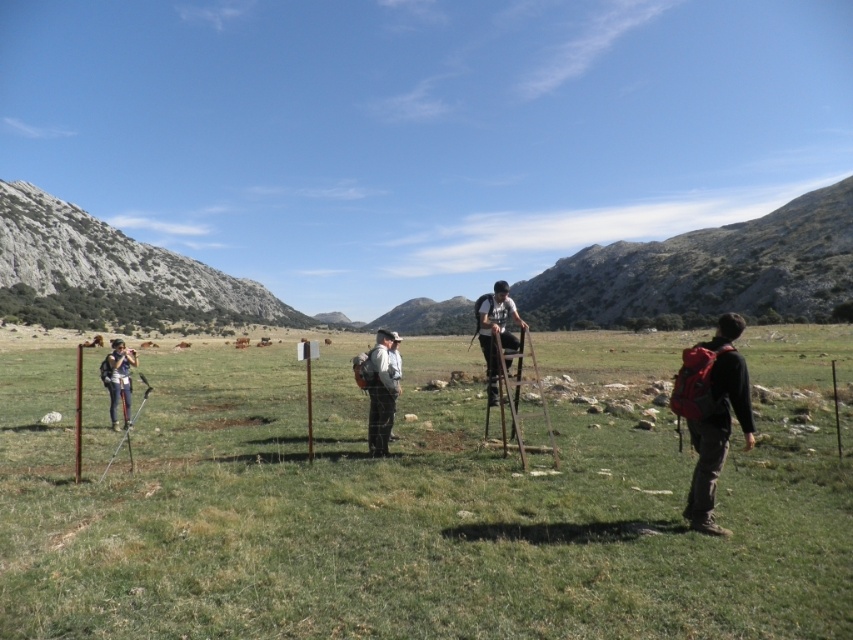
Question: Is gray rocky mountain at left further to camera compared to white fabric shirt at center?

Choices:
 (A) no
 (B) yes

Answer: (B)

Question: Does gray rocky mountain at left have a smaller size compared to matte black backpack at center?

Choices:
 (A) yes
 (B) no

Answer: (B)

Question: Based on their relative distances, which object is farther from the matte black backpack at left?

Choices:
 (A) white fabric shirt at center
 (B) green grassy field at center
 (C) red backpack at right
 (D) matte black backpack at center

Answer: (C)

Question: Does matte black backpack at center appear on the right side of white fabric shirt at center?

Choices:
 (A) yes
 (B) no

Answer: (A)

Question: Which point is closer to the camera taking this photo?

Choices:
 (A) (506, 349)
 (B) (119, 364)
 (C) (393, 406)

Answer: (C)

Question: Considering the real-world distances, which object is farthest from the matte black backpack at left?

Choices:
 (A) matte black backpack at center
 (B) gray rocky mountain at left
 (C) green grassy field at center

Answer: (B)